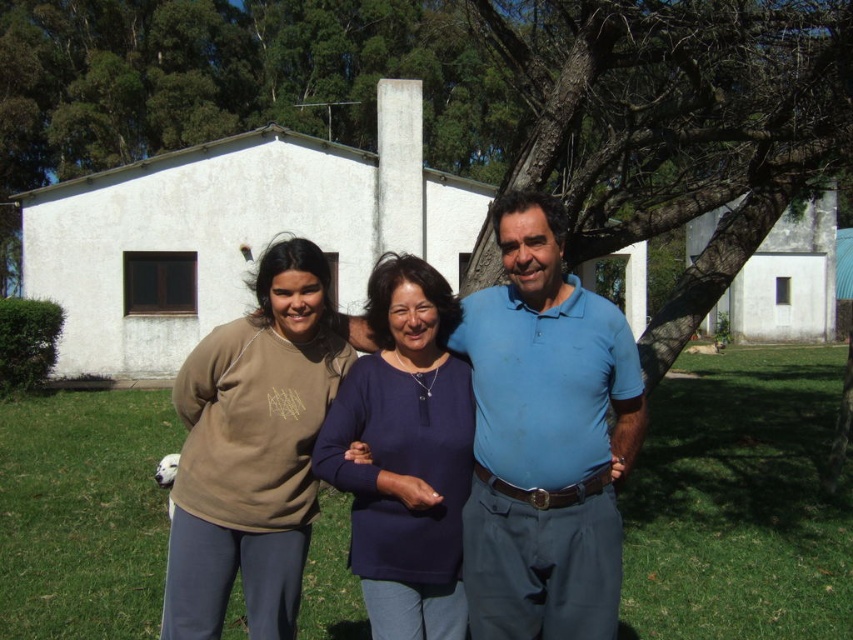
Question: Observing the image, what is the correct spatial positioning of matte brown sweater at center in reference to navy blue sweater at center?

Choices:
 (A) right
 (B) left

Answer: (A)

Question: Does matte brown sweater at center lie in front of blue cotton shirt at center?

Choices:
 (A) yes
 (B) no

Answer: (B)

Question: Which object is closer to the camera taking this photo?

Choices:
 (A) navy blue sweater at center
 (B) matte brown sweatshirt at center
 (C) matte brown sweater at center

Answer: (C)

Question: In this image, where is blue cotton shirt at center located relative to matte brown sweatshirt at center?

Choices:
 (A) left
 (B) right

Answer: (B)

Question: Which object appears closest to the camera in this image?

Choices:
 (A) matte brown sweater at center
 (B) matte brown sweatshirt at center
 (C) blue cotton shirt at center

Answer: (C)

Question: Which is farther from the matte brown sweater at center?

Choices:
 (A) matte brown sweatshirt at center
 (B) blue cotton shirt at center
 (C) navy blue sweater at center

Answer: (A)